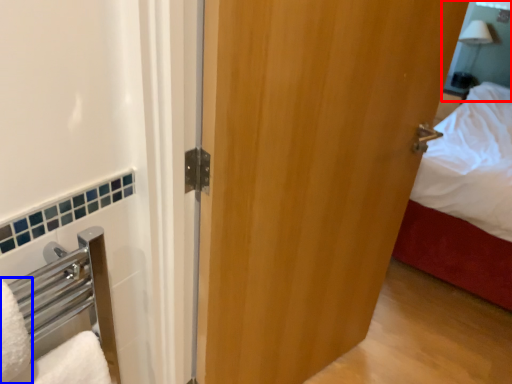
Question: Which object is closer to the camera taking this photo, mirror (highlighted by a red box) or bath towel (highlighted by a blue box)?

Choices:
 (A) mirror
 (B) bath towel

Answer: (B)